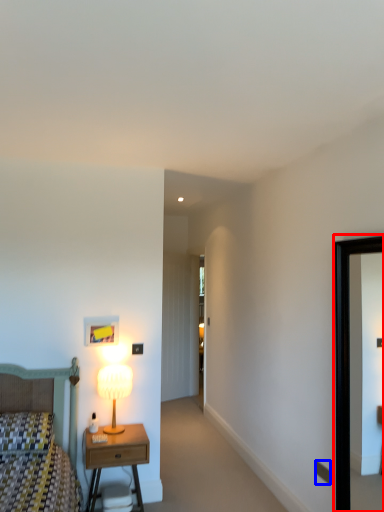
Question: Which object is closer to the camera taking this photo, picture frame (highlighted by a red box) or electric outlet (highlighted by a blue box)?

Choices:
 (A) picture frame
 (B) electric outlet

Answer: (A)